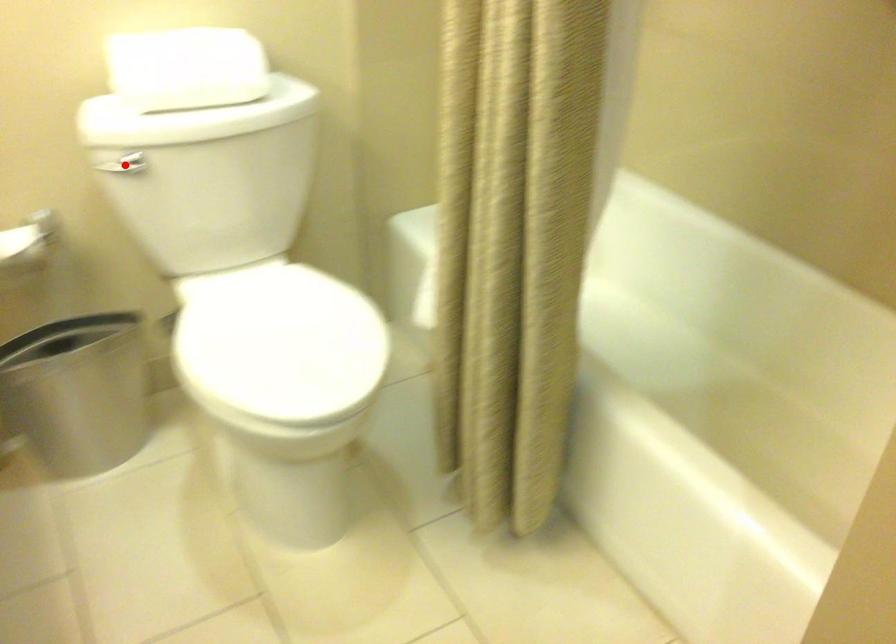
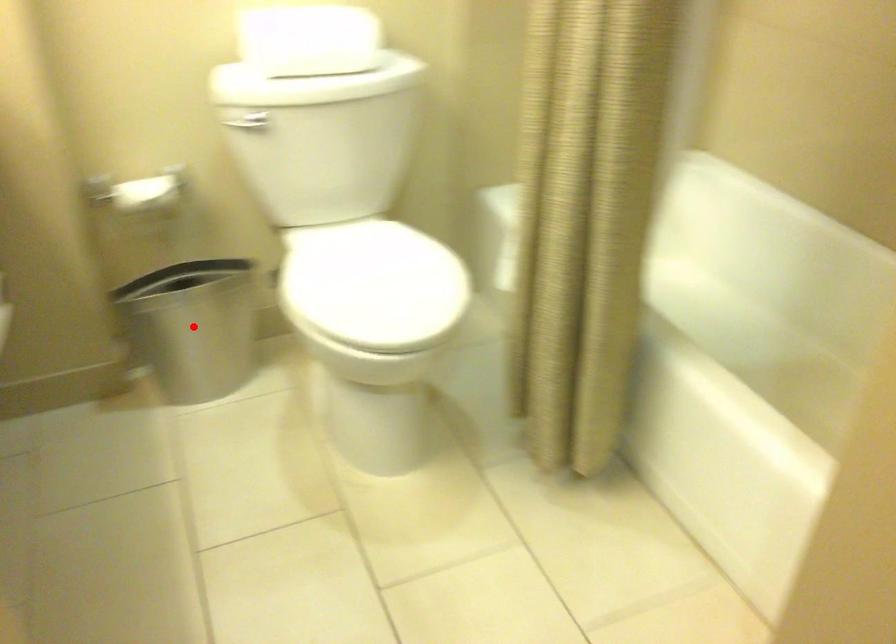
I am providing you with two images of the same scene from different viewpoints. A red point is marked on the first image and another point is marked on the second image. Does the point marked in image1 correspond to the same location as the one in image2?

No